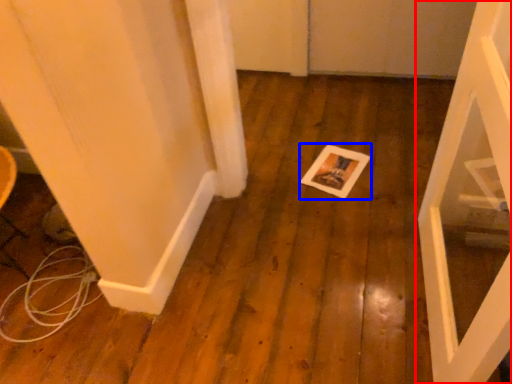
Question: Which object is closer to the camera taking this photo, door (highlighted by a red box) or postcard (highlighted by a blue box)?

Choices:
 (A) door
 (B) postcard

Answer: (A)